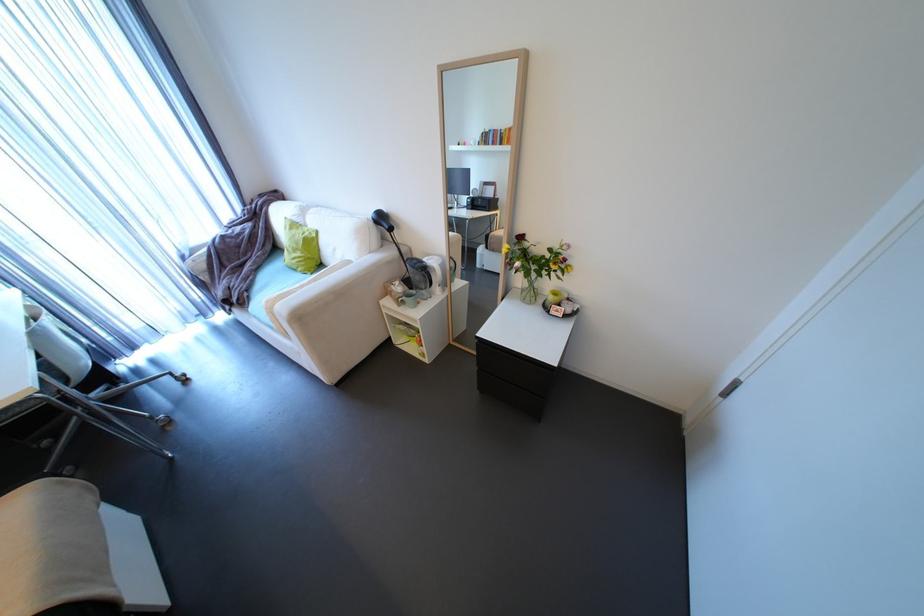
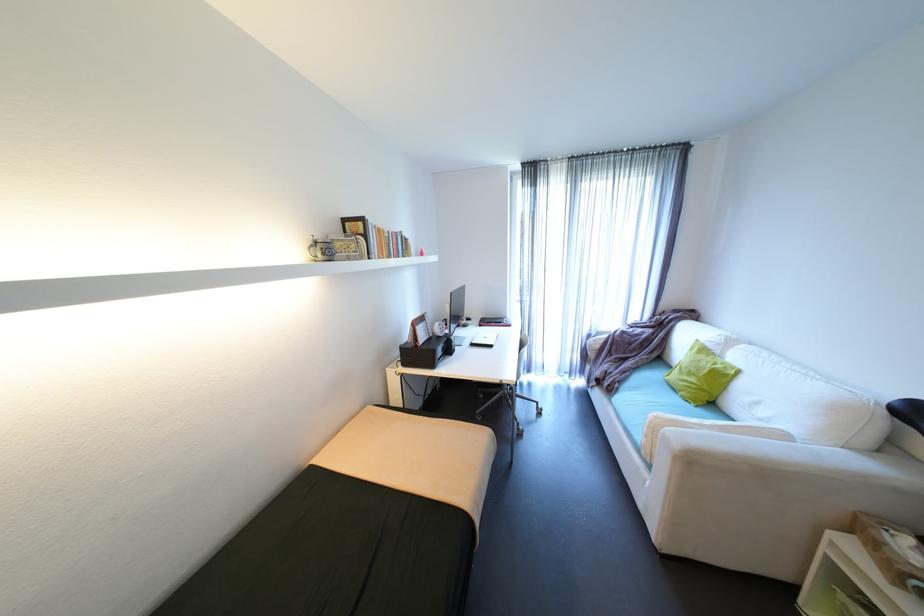
The point at (323, 233) is marked in the first image. Where is the corresponding point in the second image?

(747, 371)